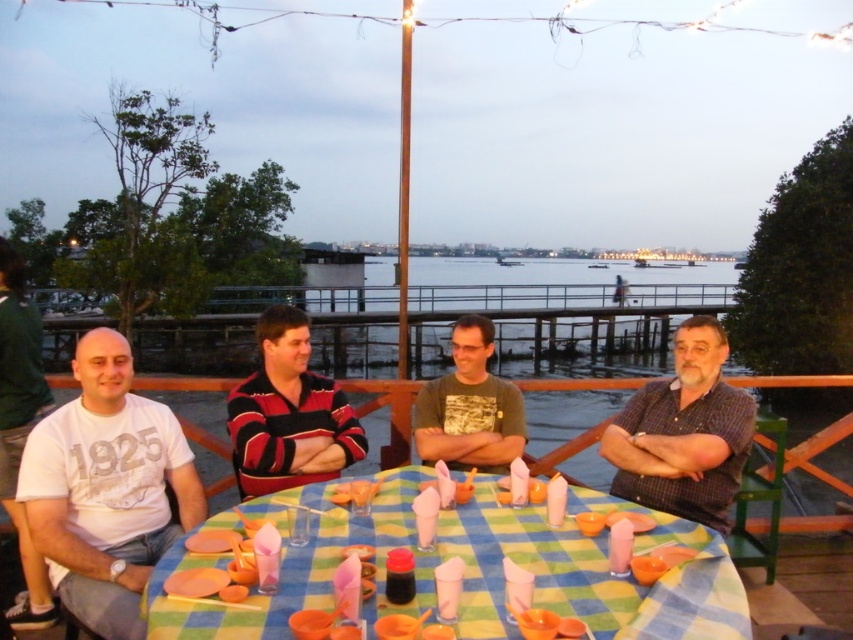
What is the color of the clothing item located at the coordinates point (x=106, y=488)?

The clothing item at point (x=106, y=488) is a white cotton t shirt.